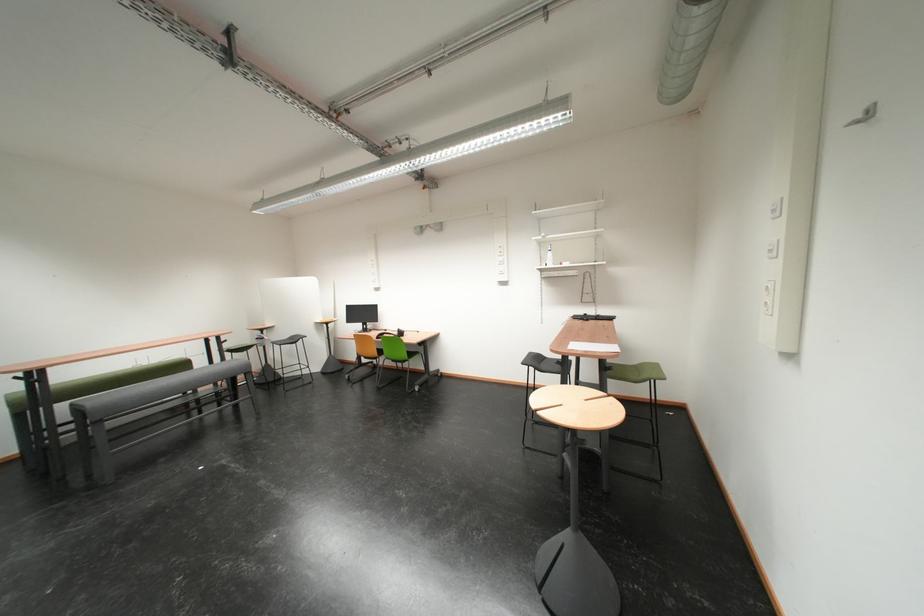
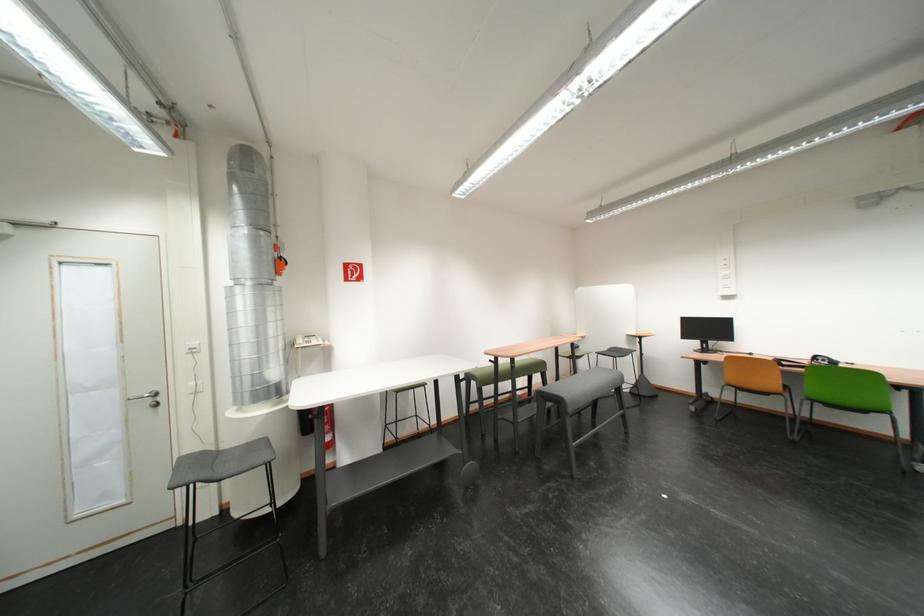
In the second image, find the point that corresponds to the point at 32,378 in the first image.

(505, 362)